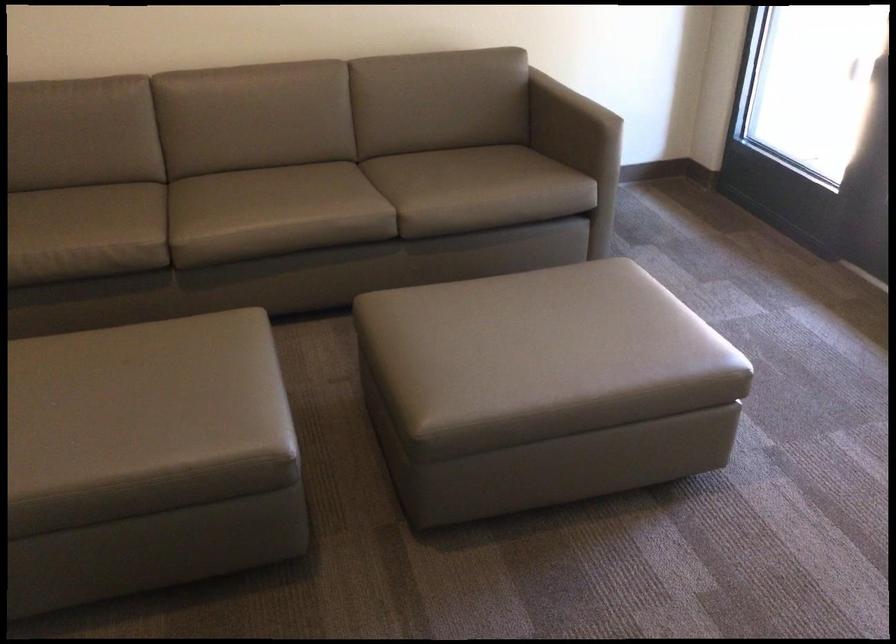
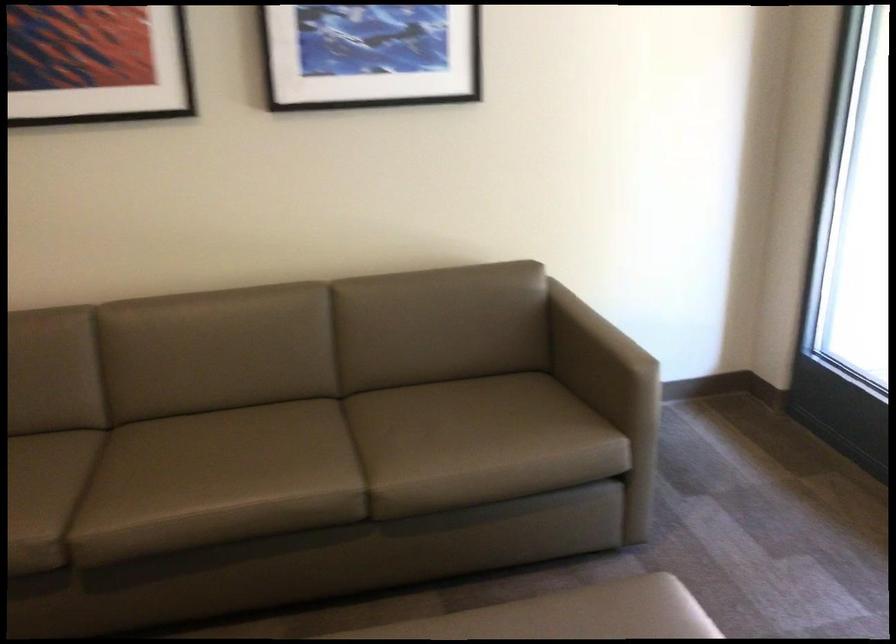
Question: The images are taken continuously from a first-person perspective. In which direction are you moving?

Choices:
 (A) Left
 (B) Right
 (C) Forward
 (D) Backward

Answer: (C)